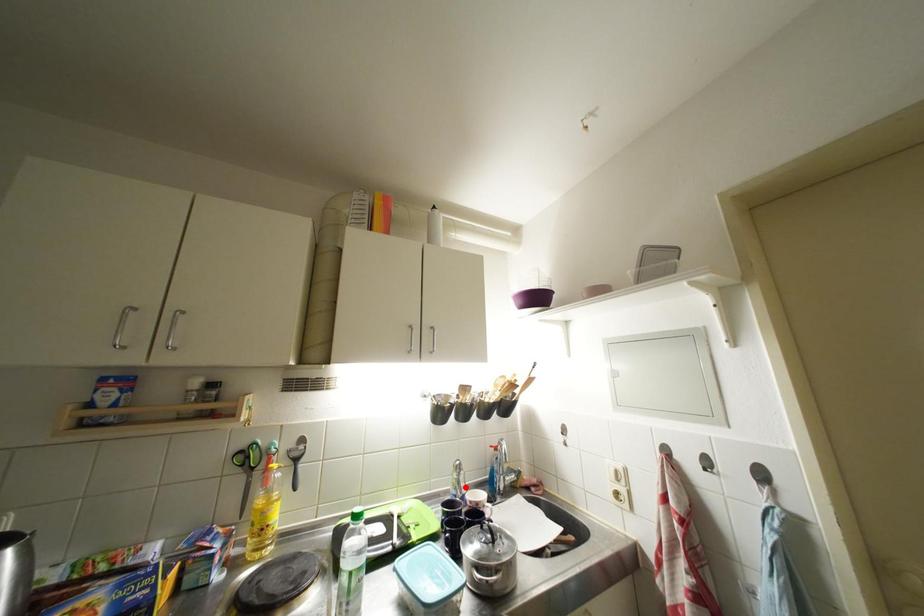
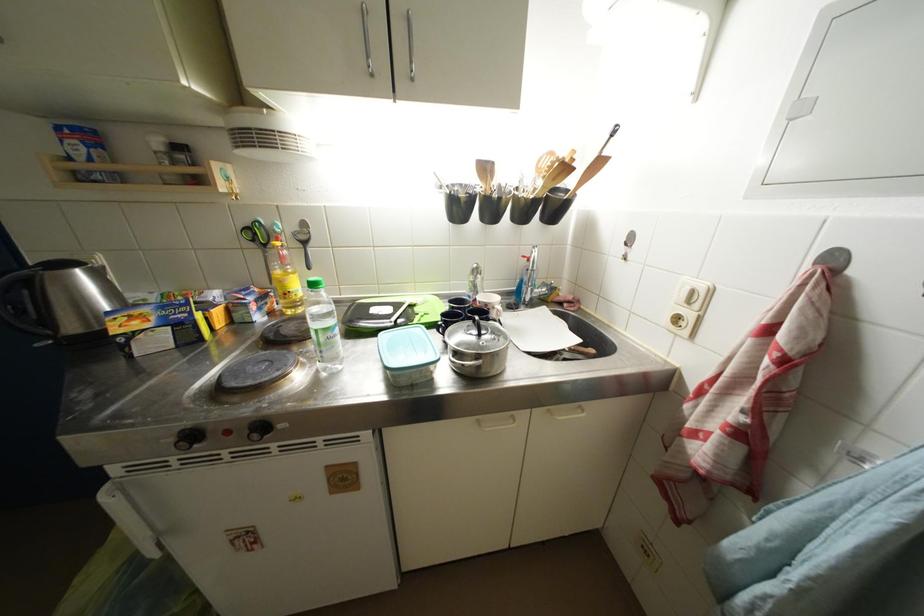
Where in the second image is the point corresponding to the highlighted location from the first image?

(481, 291)